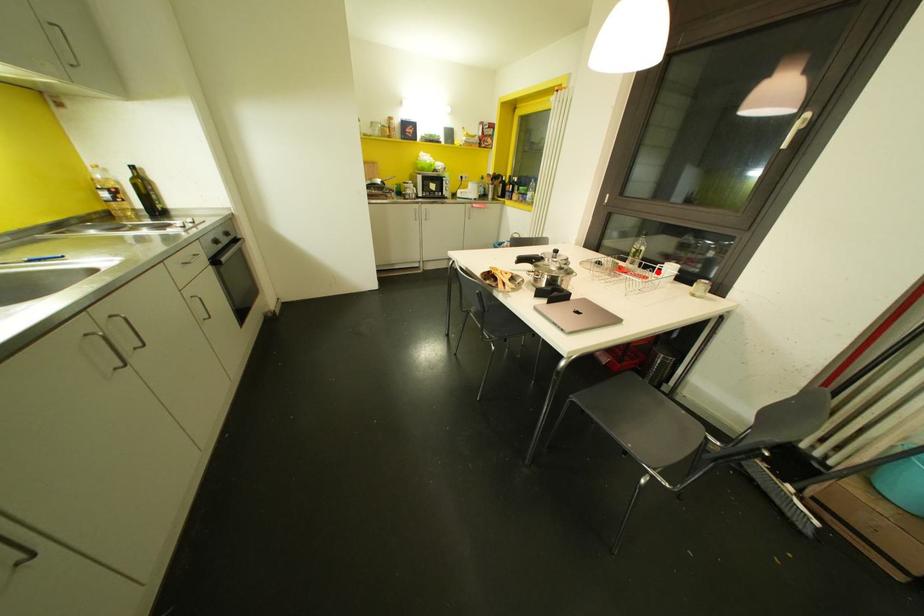
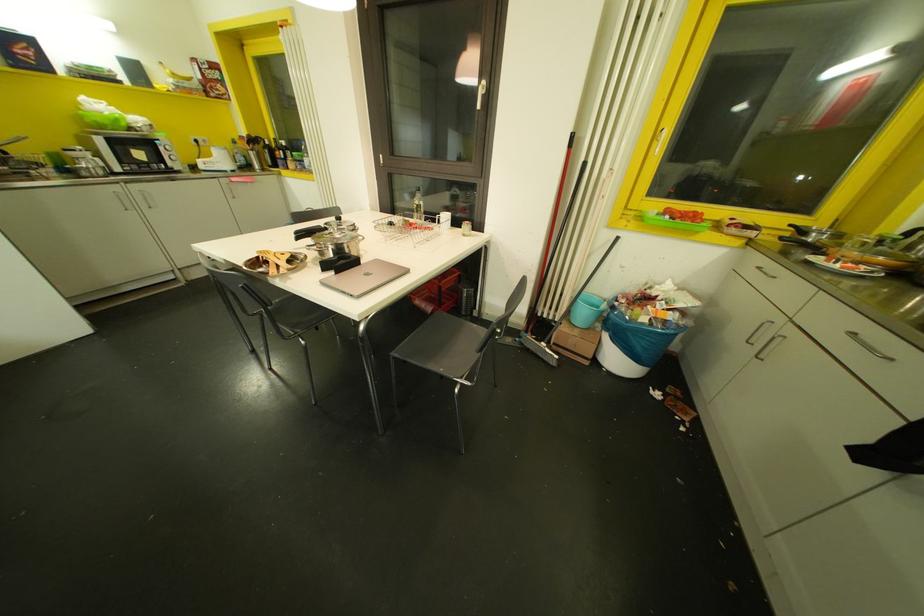
Locate, in the second image, the point that corresponds to the highlighted location in the first image.

(441, 222)